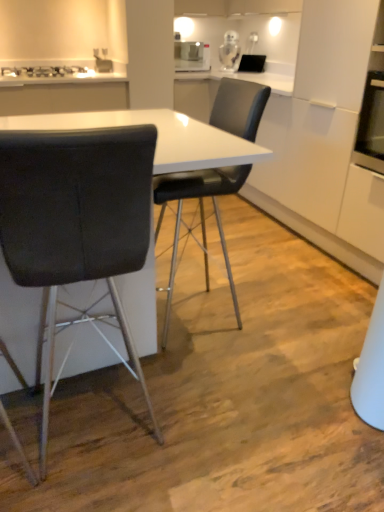
Question: Considering the positions of point (193, 61) and point (220, 53), is point (193, 61) closer or farther from the camera than point (220, 53)?

Choices:
 (A) farther
 (B) closer

Answer: (B)

Question: Looking at the image, does white glossy toaster at upper center, marked as the 2th appliance in a right-to-left arrangement, seem bigger or smaller compared to clear glass jar at upper center, which is counted as the 1th appliance, starting from the right?

Choices:
 (A) small
 (B) big

Answer: (B)

Question: Which object is the closest to the white glossy toaster at upper center, marked as the first appliance in a left-to-right arrangement?

Choices:
 (A) white glossy table at center
 (B) metallic silver gas stove at upper left
 (C) black leather chair at left, which is counted as the first chair, starting from the left
 (D) black leather chair at center, which ranks as the 2th chair in left-to-right order
 (E) clear glass jar at upper center, placed as the 2th appliance when sorted from left to right

Answer: (E)

Question: Which object is positioned closest to the metallic silver gas stove at upper left?

Choices:
 (A) clear glass jar at upper center, which is counted as the 1th appliance, starting from the right
 (B) white glossy table at center
 (C) white glossy toaster at upper center, marked as the 2th appliance in a right-to-left arrangement
 (D) black leather chair at left, which is the second chair in right-to-left order
 (E) black leather chair at center, which is the 1th chair from right to left

Answer: (C)